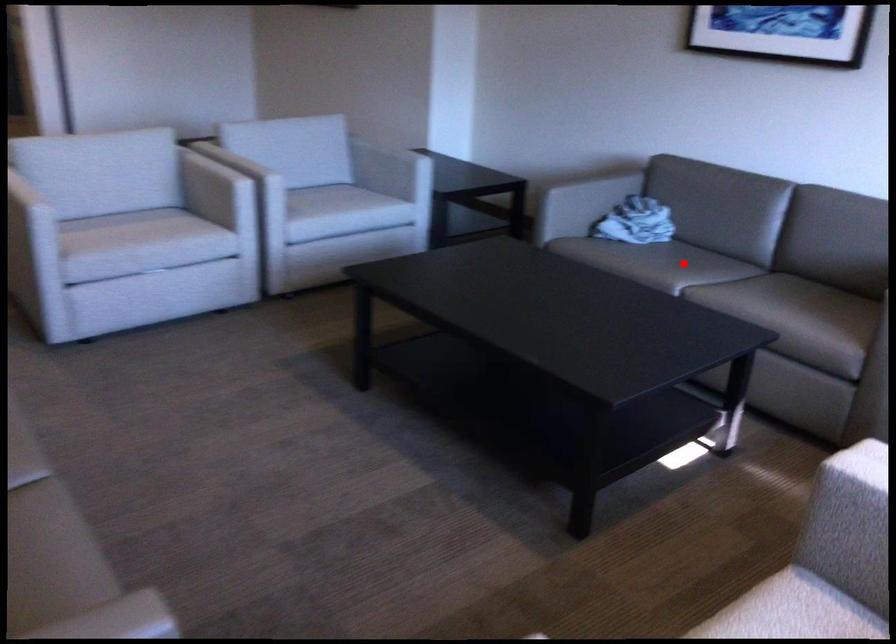
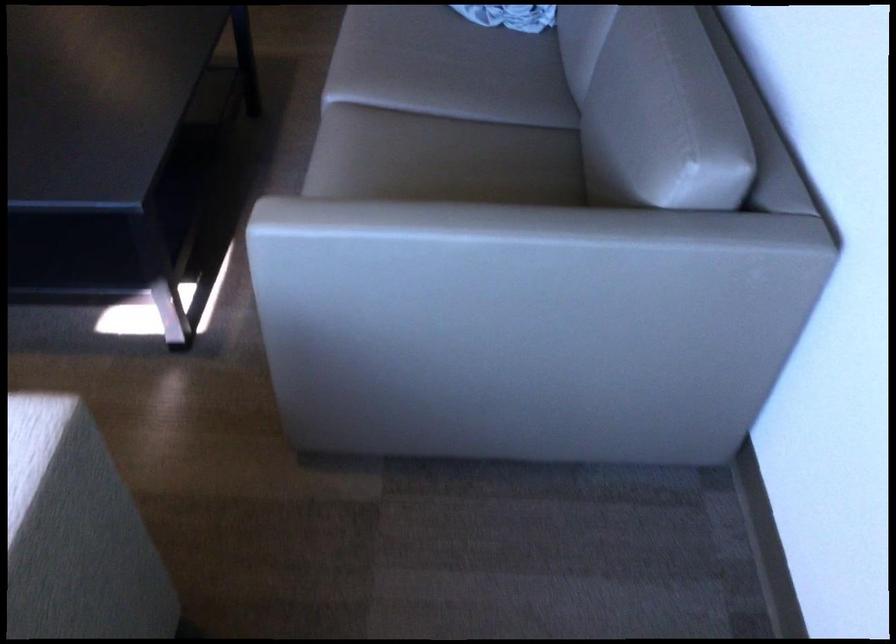
Find the pixel in the second image that matches the highlighted location in the first image.

(463, 73)